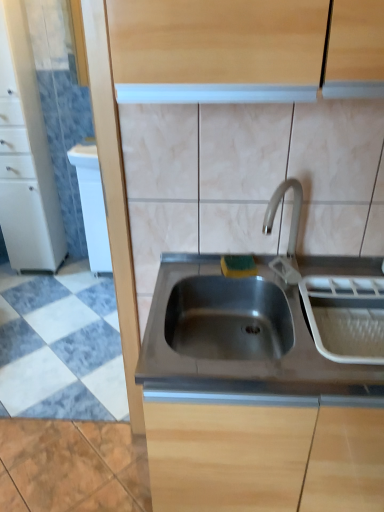
At what (x,y) coordinates should I click in order to perform the action: click on free location to the right of white glossy cabinet at left, marked as the first cabinetry in a left-to-right arrangement. Please return your answer as a coordinate pair (x, y). The height and width of the screenshot is (512, 384). Looking at the image, I should click on (69, 275).